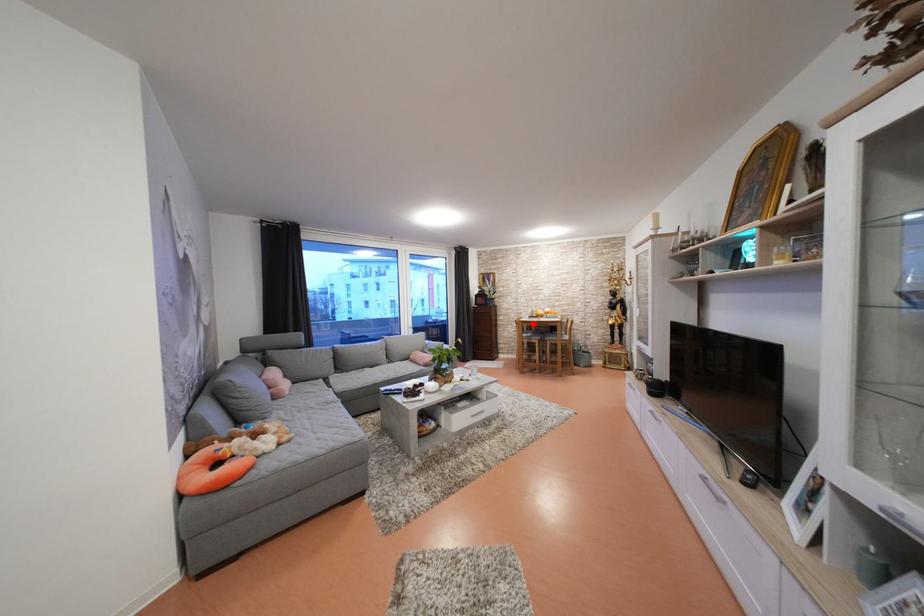
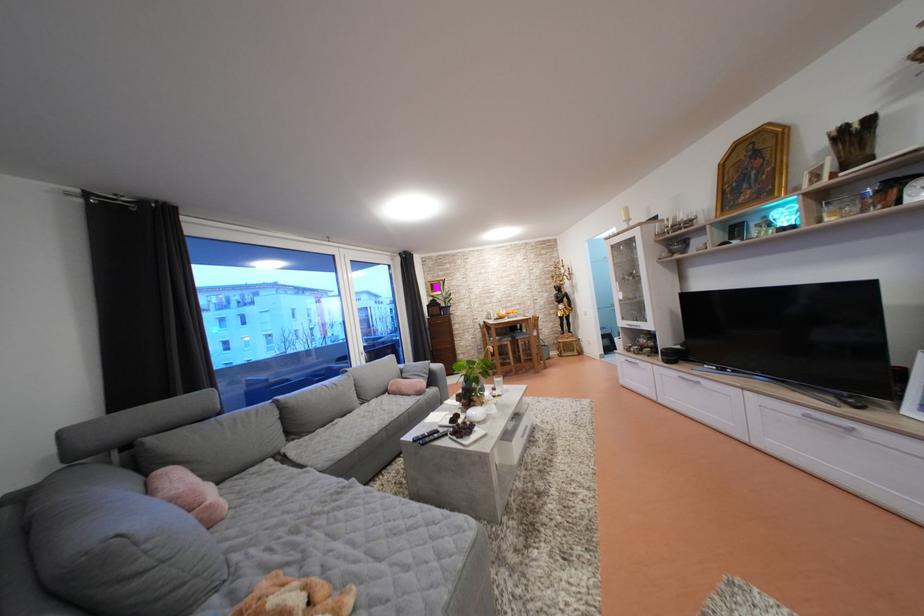
In the second image, find the point that corresponds to the highlighted location in the first image.

(497, 328)